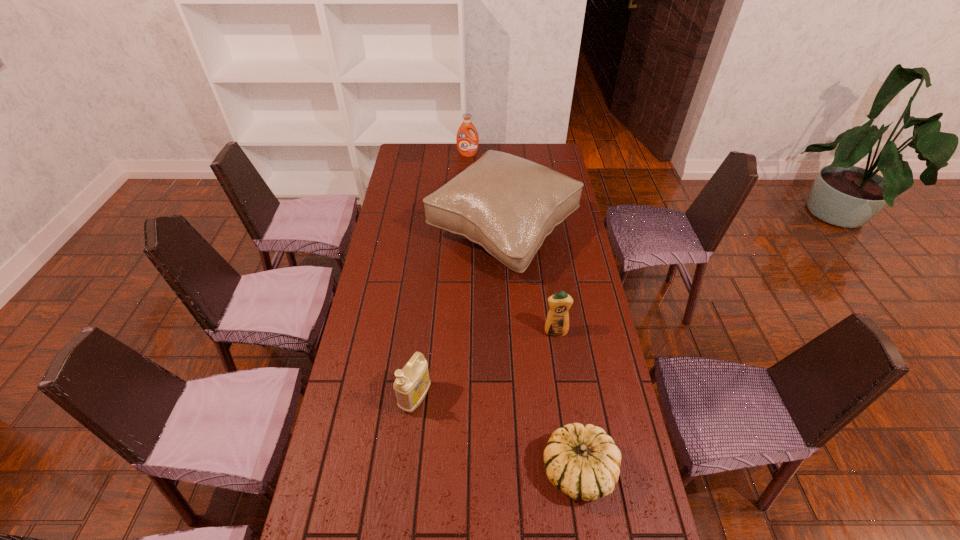
The height and width of the screenshot is (540, 960). I want to click on the tallest object, so click(507, 204).

Locate an element on the screen. cushion is located at coordinates (507, 204).

The width and height of the screenshot is (960, 540). In order to click on the farthest detergent in this screenshot , I will do `click(467, 144)`.

Find the location of a particular element. The image size is (960, 540). the farthest object is located at coordinates (467, 144).

Image resolution: width=960 pixels, height=540 pixels. I want to click on the rightmost detergent, so click(x=557, y=323).

Identify the location of the third farthest object. (557, 323).

At what (x,y) coordinates should I click in order to perform the action: click on the leftmost detergent. Please return your answer as a coordinate pair (x, y). Looking at the image, I should click on (411, 385).

Find the location of a particular element. The height and width of the screenshot is (540, 960). the nearest detergent is located at coordinates (411, 385).

In order to click on the shortest object in this screenshot , I will do `click(583, 462)`.

I want to click on the nearest object, so [583, 462].